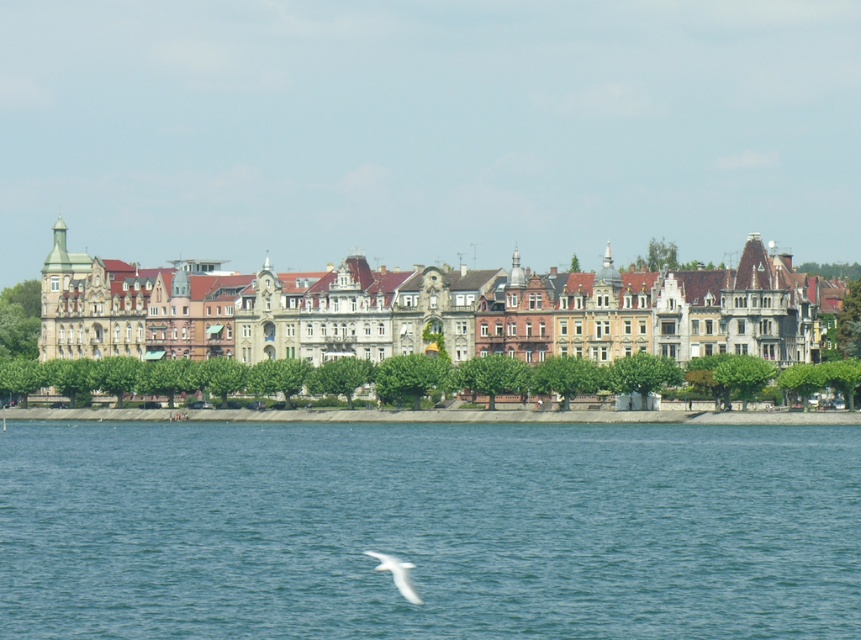
Question: Which point is farther to the camera?

Choices:
 (A) tap(592, 625)
 (B) tap(392, 557)

Answer: (B)

Question: Which object is farther from the camera taking this photo?

Choices:
 (A) white feathered bird at lower center
 (B) blue water at lower center

Answer: (A)

Question: Is blue water at lower center smaller than white feathered bird at lower center?

Choices:
 (A) no
 (B) yes

Answer: (A)

Question: Can you confirm if blue water at lower center is positioned above white feathered bird at lower center?

Choices:
 (A) yes
 (B) no

Answer: (A)

Question: Is blue water at lower center bigger than white feathered bird at lower center?

Choices:
 (A) yes
 (B) no

Answer: (A)